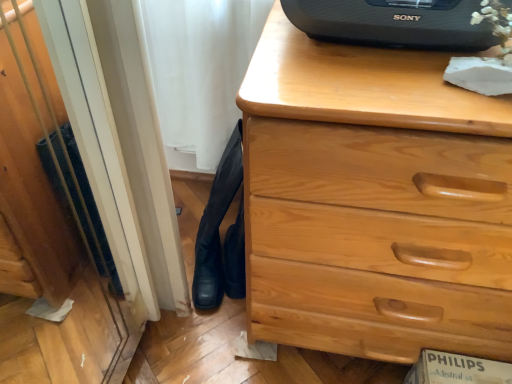
Find the location of `light wood chest of drawers at center`. light wood chest of drawers at center is located at coordinates (374, 202).

Locate an element on the screen. This screenshot has width=512, height=384. black leather boots at lower left is located at coordinates (219, 236).

What do you see at coordinates (393, 23) in the screenshot? The height and width of the screenshot is (384, 512). I see `black plastic speaker at upper center` at bounding box center [393, 23].

This screenshot has width=512, height=384. I want to click on light wood chest of drawers at center, so click(374, 202).

How distant is black plastic speaker at upper center from black leather boots at lower left?

black plastic speaker at upper center is 20.50 inches from black leather boots at lower left.

Looking at this image, is black plastic speaker at upper center positioned with its back to black leather boots at lower left?

No, black plastic speaker at upper center's orientation is not away from black leather boots at lower left.

Which is behind, point (419, 37) or point (234, 159)?

The point (234, 159) is farther from the camera.

Is black leather boots at lower left in front of light wood chest of drawers at center?

No.

Between black leather boots at lower left and light wood chest of drawers at center, which one has smaller size?

black leather boots at lower left is smaller.

From the image's perspective, is black leather boots at lower left positioned above or below light wood chest of drawers at center?

Clearly, from the image's perspective, black leather boots at lower left is below light wood chest of drawers at center.

From a real-world perspective, relative to light wood chest of drawers at center, is black leather boots at lower left vertically above or below?

Clearly, from a real-world perspective, black leather boots at lower left is below light wood chest of drawers at center.

Is light wood chest of drawers at center aimed at black plastic speaker at upper center?

No.

Visually, is light wood chest of drawers at center positioned to the left or to the right of black plastic speaker at upper center?

Clearly, light wood chest of drawers at center is on the right of black plastic speaker at upper center in the image.

From their relative heights in the image, would you say light wood chest of drawers at center is taller or shorter than black plastic speaker at upper center?

Clearly, light wood chest of drawers at center is taller compared to black plastic speaker at upper center.

From the image's perspective, is light wood chest of drawers at center on top of black plastic speaker at upper center?

No, from the image's perspective, light wood chest of drawers at center is not over black plastic speaker at upper center.

From a real-world perspective, is black plastic speaker at upper center below light wood chest of drawers at center?

No, from a real-world perspective, black plastic speaker at upper center is not under light wood chest of drawers at center.

Does black plastic speaker at upper center have a greater width compared to light wood chest of drawers at center?

Incorrect, the width of black plastic speaker at upper center does not surpass that of light wood chest of drawers at center.

Which is closer to the camera, [353,14] or [364,59]?

The point [353,14] is in front.

Is black plastic speaker at upper center completely or partially outside of light wood chest of drawers at center?

black plastic speaker at upper center is positioned outside light wood chest of drawers at center.

Where is `desktop computer on the right of the black leather boots at lower left`? desktop computer on the right of the black leather boots at lower left is located at coordinates (393, 23).

Are black leather boots at lower left and black plastic speaker at upper center making contact?

No, black leather boots at lower left is not beside black plastic speaker at upper center.

Does black leather boots at lower left have a lesser height compared to black plastic speaker at upper center?

No.

Is black leather boots at lower left to the left or to the right of black plastic speaker at upper center in the image?

Based on their positions, black leather boots at lower left is located to the left of black plastic speaker at upper center.

Is light wood chest of drawers at center closer to the viewer compared to black leather boots at lower left?

Yes, the depth of light wood chest of drawers at center is less than that of black leather boots at lower left.

Is light wood chest of drawers at center positioned beyond the bounds of black leather boots at lower left?

That's correct, light wood chest of drawers at center is outside of black leather boots at lower left.

Is light wood chest of drawers at center shorter than black leather boots at lower left?

No.

Is light wood chest of drawers at center turned away from black leather boots at lower left?

That's not correct — light wood chest of drawers at center is not looking away from black leather boots at lower left.

At what (x,y) coordinates should I click in order to perform the action: click on tight located underneath the black plastic speaker at upper center (from a real-world perspective). Please return your answer as a coordinate pair (x, y). The height and width of the screenshot is (384, 512). Looking at the image, I should click on (219, 236).

This screenshot has height=384, width=512. Identify the location of tight that appears behind the light wood chest of drawers at center. [x=219, y=236].

Based on their spatial positions, is black leather boots at lower left or light wood chest of drawers at center closer to black plastic speaker at upper center?

The object closer to black plastic speaker at upper center is light wood chest of drawers at center.

From the image, which object appears to be nearer to light wood chest of drawers at center, black leather boots at lower left or black plastic speaker at upper center?

black plastic speaker at upper center.

Estimate the real-world distances between objects in this image. Which object is closer to light wood chest of drawers at center, black plastic speaker at upper center or black leather boots at lower left?

The object closer to light wood chest of drawers at center is black plastic speaker at upper center.

Looking at the image, which one is located closer to black leather boots at lower left, black plastic speaker at upper center or light wood chest of drawers at center?

light wood chest of drawers at center lies closer to black leather boots at lower left than the other object.

Looking at the image, which one is located closer to black plastic speaker at upper center, light wood chest of drawers at center or black leather boots at lower left?

light wood chest of drawers at center.

Considering their positions, is light wood chest of drawers at center positioned closer to black leather boots at lower left than black plastic speaker at upper center?

The object closer to black leather boots at lower left is light wood chest of drawers at center.

Identify the location of the chest of drawers between black plastic speaker at upper center and black leather boots at lower left vertically. The width and height of the screenshot is (512, 384). (374, 202).